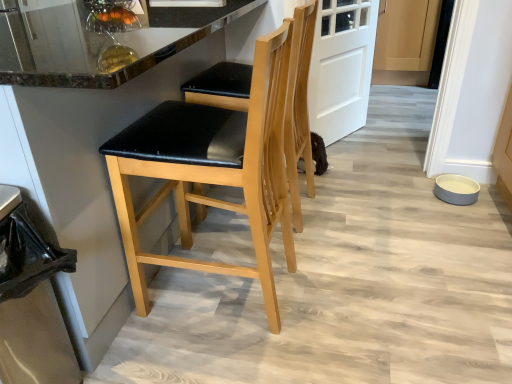
The width and height of the screenshot is (512, 384). What are the coordinates of `matte black seat at center, placed as the first chair when sorted from back to front` in the screenshot? It's located at (298, 108).

Identify the location of black leather stool at left. (99, 170).

The height and width of the screenshot is (384, 512). What do you see at coordinates (406, 35) in the screenshot?
I see `light wood cabinet at center` at bounding box center [406, 35].

In order to face light wood cabinet at center, should I rotate leftwards or rightwards?

You should look right and rotate roughly 18.801 degrees.

This screenshot has width=512, height=384. What do you see at coordinates (31, 301) in the screenshot? I see `black plastic trash can at lower left` at bounding box center [31, 301].

Locate an element on the screen. This screenshot has height=384, width=512. matte black seat at center, placed as the 2th chair when sorted from front to back is located at coordinates (298, 108).

From their relative heights in the image, would you say black plastic trash can at lower left is taller or shorter than light wood cabinet at center?

black plastic trash can at lower left is shorter than light wood cabinet at center.

Does point (15, 222) lie behind point (414, 7)?

No, (15, 222) is closer to viewer.

Is black plastic trash can at lower left next to light wood cabinet at center?

No, black plastic trash can at lower left is not next to light wood cabinet at center.

From the image's perspective, which one is positioned lower, black plastic trash can at lower left or light wood cabinet at center?

black plastic trash can at lower left appears lower in the image.

Considering the relative positions of light wood cabinet at center and matte black seat at center, placed as the 2th chair when sorted from front to back, in the image provided, is light wood cabinet at center to the left or to the right of matte black seat at center, placed as the 2th chair when sorted from front to back,?

In the image, light wood cabinet at center appears on the right side of matte black seat at center, placed as the 2th chair when sorted from front to back.

Does point (404, 52) appear closer or farther from the camera than point (248, 80)?

Point (404, 52) is positioned farther from the camera compared to point (248, 80).

Is light wood cabinet at center closer to the viewer compared to matte black seat at center, placed as the first chair when sorted from back to front?

That is False.

Which object is thinner, light wood cabinet at center or matte black seat at center, placed as the first chair when sorted from back to front?

With smaller width is matte black seat at center, placed as the first chair when sorted from back to front.

Does white matte door at center have a greater height compared to black leather stool at left?

Incorrect, the height of white matte door at center is not larger of that of black leather stool at left.

Is white matte door at center outside of black leather stool at left?

Indeed, white matte door at center is completely outside black leather stool at left.

Which of these two, white matte door at center or black leather stool at left, is smaller?

A: Smaller between the two is white matte door at center.

Looking at their sizes, would you say white matte door at center is wider or thinner than black leather stool at left?

Clearly, white matte door at center has less width compared to black leather stool at left.

Which is less distant, (375, 52) or (174, 135)?

Positioned in front is point (174, 135).

From a real-world perspective, who is located lower, light wood cabinet at center or black leather stool at left, the first chair from the front?

light wood cabinet at center is physically lower.

Is black leather stool at left, the first chair from the front, surrounded by light wood cabinet at center?

No, black leather stool at left, the first chair from the front, is not surrounded by light wood cabinet at center.

Where is `the 2nd chair positioned below the light wood cabinet at center (from the image's perspective)`? The width and height of the screenshot is (512, 384). the 2nd chair positioned below the light wood cabinet at center (from the image's perspective) is located at coordinates (212, 170).

Would you say light wood cabinet at center is part of white matte door at center's contents?

No.

Could you tell me if white matte door at center is turned towards light wood cabinet at center?

No.

Which object is further away from the camera, white matte door at center or light wood cabinet at center?

Positioned behind is light wood cabinet at center.

Locate an element on the screen. The image size is (512, 384). door located in front of the light wood cabinet at center is located at coordinates (341, 66).

Would you say light wood cabinet at center is a long distance from white matte door at center?

Yes.

Is light wood cabinet at center oriented towards white matte door at center?

Yes.

From the image's perspective, is light wood cabinet at center over white matte door at center?

Yes, from the image's perspective, light wood cabinet at center is on top of white matte door at center.

Identify the location of chair below the matte black seat at center, placed as the first chair when sorted from back to front (from the image's perspective). (212, 170).

Is black leather stool at left, the second chair when ordered from back to front, thinner than matte black seat at center, placed as the first chair when sorted from back to front?

Yes.

How distant is black leather stool at left, the second chair when ordered from back to front, from matte black seat at center, placed as the first chair when sorted from back to front?

black leather stool at left, the second chair when ordered from back to front, and matte black seat at center, placed as the first chair when sorted from back to front, are 12.19 inches apart from each other.

Considering the positions of objects black leather stool at left, the first chair from the front, and matte black seat at center, placed as the first chair when sorted from back to front, in the image provided, who is more to the right, black leather stool at left, the first chair from the front, or matte black seat at center, placed as the first chair when sorted from back to front,?

Positioned to the right is matte black seat at center, placed as the first chair when sorted from back to front.

This screenshot has width=512, height=384. I want to click on appliance lying below the light wood cabinet at center (from the image's perspective), so click(31, 301).

Locate an element on the screen. cabinetry that is on the right side of matte black seat at center, placed as the first chair when sorted from back to front is located at coordinates (406, 35).

Looking at the image, which one is located further to black plastic trash can at lower left, white matte door at center or black leather stool at left?

The object further to black plastic trash can at lower left is white matte door at center.

Considering their positions, is black plastic trash can at lower left positioned closer to matte black seat at center, placed as the 2th chair when sorted from front to back, than black leather stool at left, the second chair when ordered from back to front?

Among the two, black leather stool at left, the second chair when ordered from back to front, is located nearer to matte black seat at center, placed as the 2th chair when sorted from front to back.

Looking at the image, which one is located further to black leather stool at left, the second chair when ordered from back to front, white matte door at center or light wood cabinet at center?

light wood cabinet at center is positioned further to the anchor black leather stool at left, the second chair when ordered from back to front.

From the image, which object appears to be nearer to black leather stool at left, white matte door at center or matte black seat at center, placed as the 2th chair when sorted from front to back?

matte black seat at center, placed as the 2th chair when sorted from front to back, is closer to black leather stool at left.

When comparing their distances from white matte door at center, does black leather stool at left or black leather stool at left, the second chair when ordered from back to front, seem closer?

black leather stool at left lies closer to white matte door at center than the other object.

Based on their spatial positions, is black plastic trash can at lower left or gray matte bowl at lower right further from black leather stool at left?

gray matte bowl at lower right is positioned further to the anchor black leather stool at left.

When comparing their distances from black leather stool at left, does light wood cabinet at center or gray matte bowl at lower right seem closer?

gray matte bowl at lower right lies closer to black leather stool at left than the other object.

Considering their positions, is matte black seat at center, placed as the first chair when sorted from back to front, positioned closer to black leather stool at left, the first chair from the front, than light wood cabinet at center?

Based on the image, matte black seat at center, placed as the first chair when sorted from back to front, appears to be nearer to black leather stool at left, the first chair from the front.

Where is `chair positioned between black leather stool at left, the second chair when ordered from back to front, and light wood cabinet at center from near to far`? chair positioned between black leather stool at left, the second chair when ordered from back to front, and light wood cabinet at center from near to far is located at coordinates pos(298,108).

I want to click on bowl between black leather stool at left, the second chair when ordered from back to front, and white matte door at center, along the z-axis, so click(456, 189).

I want to click on door between black plastic trash can at lower left and light wood cabinet at center from front to back, so click(x=341, y=66).

What are the coordinates of `door between black leather stool at left, the second chair when ordered from back to front, and light wood cabinet at center, along the z-axis` in the screenshot? It's located at (341, 66).